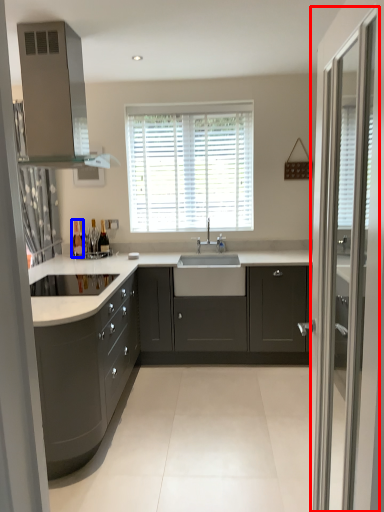
Question: Which object is further to the camera taking this photo, screen door (highlighted by a red box) or bottle (highlighted by a blue box)?

Choices:
 (A) screen door
 (B) bottle

Answer: (B)